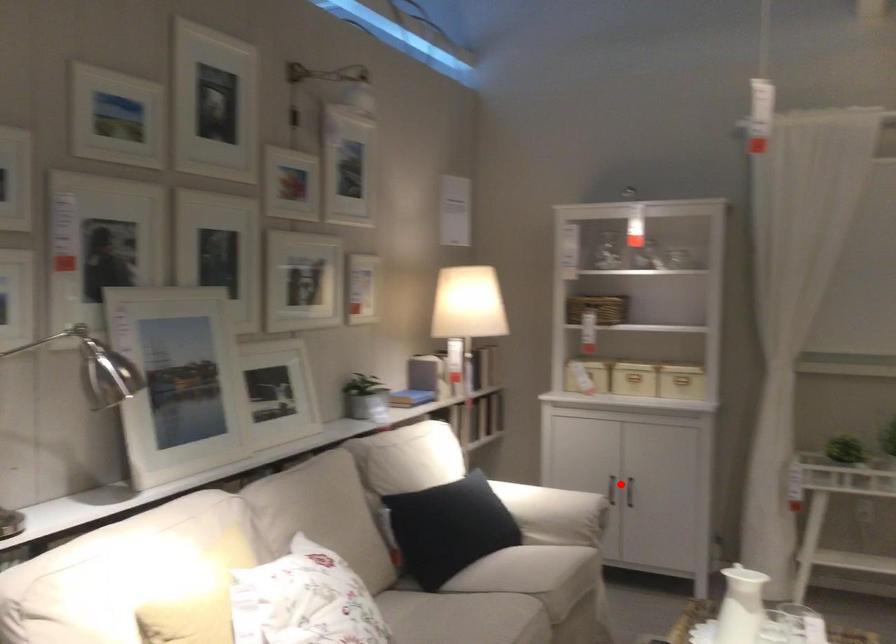
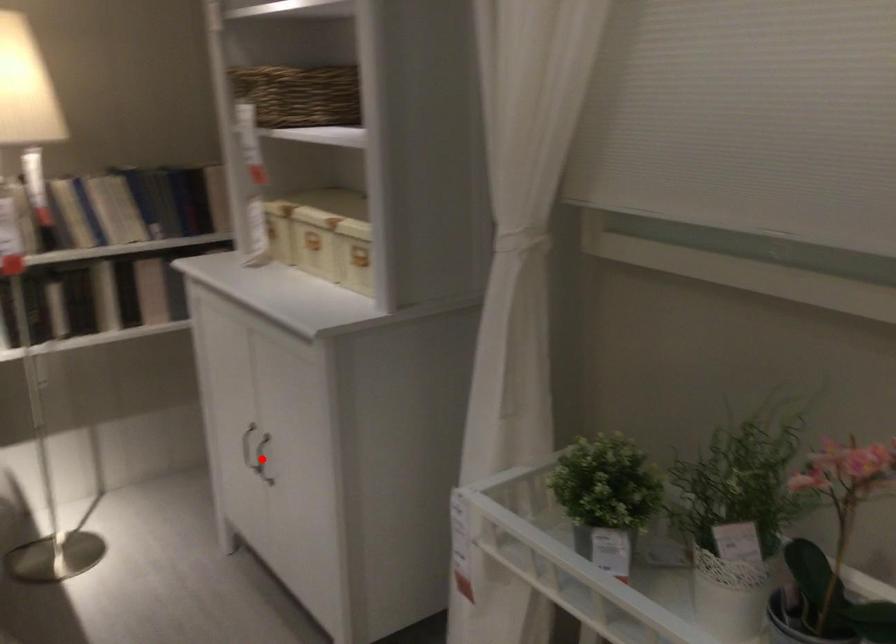
I am providing you with two images of the same scene from different viewpoints. A red point is marked on the first image and another point is marked on the second image. Does the point marked in image1 correspond to the same location as the one in image2?

No